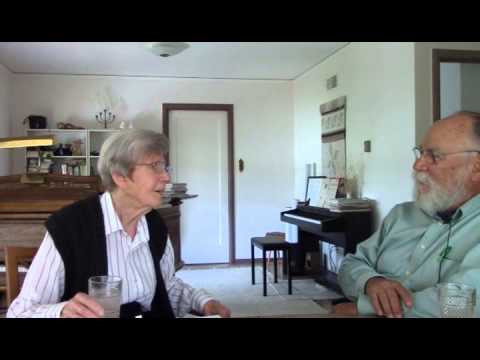
The width and height of the screenshot is (480, 360). Identify the location of piano. (315, 217).